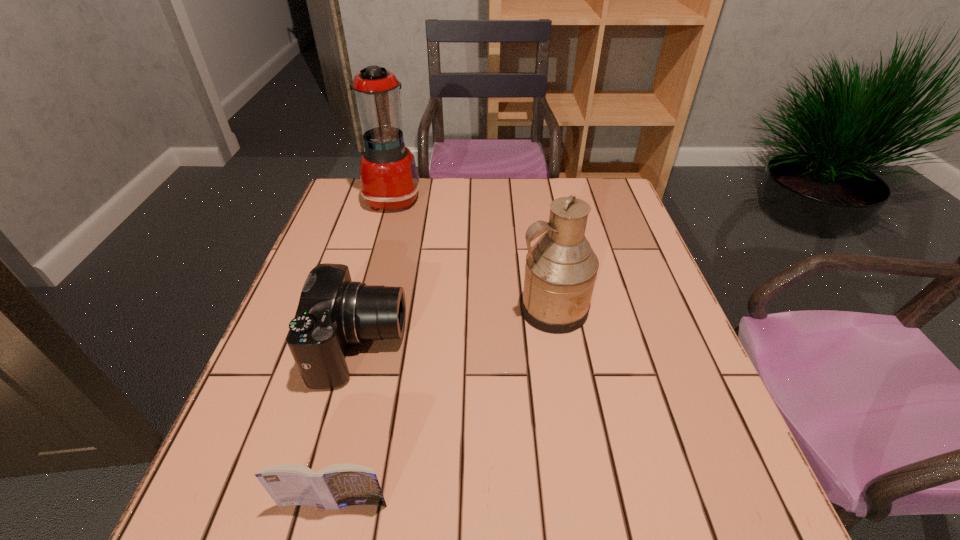
The width and height of the screenshot is (960, 540). I want to click on the tallest object, so click(x=389, y=180).

Image resolution: width=960 pixels, height=540 pixels. What are the coordinates of `the farthest object` in the screenshot? It's located at (389, 180).

This screenshot has height=540, width=960. I want to click on pitcher, so click(561, 267).

What are the coordinates of `the second tallest object` in the screenshot? It's located at (561, 267).

This screenshot has height=540, width=960. I want to click on camera, so click(334, 312).

This screenshot has height=540, width=960. Identify the location of the shortest object. (335, 486).

The height and width of the screenshot is (540, 960). In order to click on the nearest object in this screenshot , I will do `click(335, 486)`.

Identify the location of vacant region located 0.360m on the controls of the farthest object. The image size is (960, 540). pyautogui.click(x=537, y=198).

Identify the location of vacant space located 0.340m on the front of the second tallest object. (585, 495).

Where is `vacant space located 0.160m on the lens of the second shortest object`? This screenshot has width=960, height=540. vacant space located 0.160m on the lens of the second shortest object is located at coordinates (478, 346).